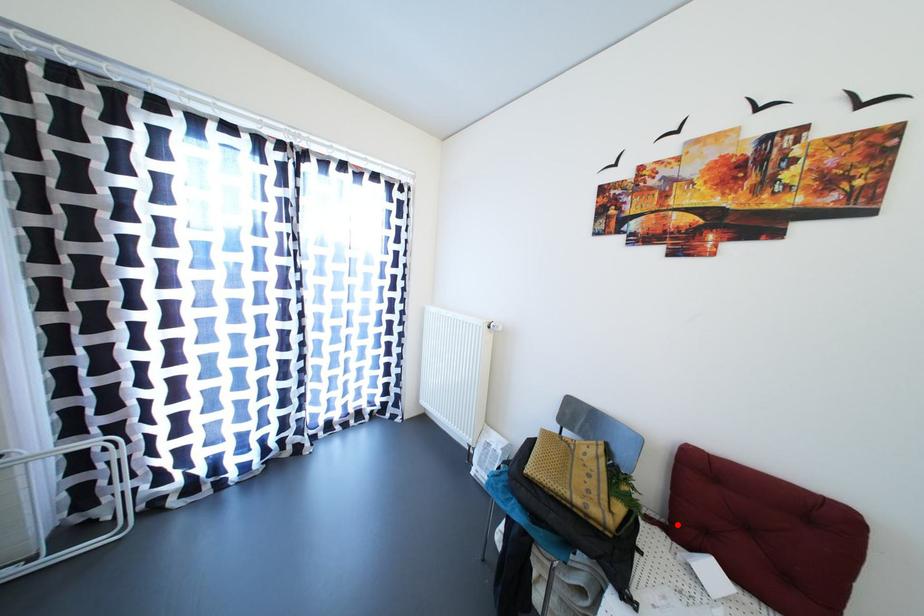
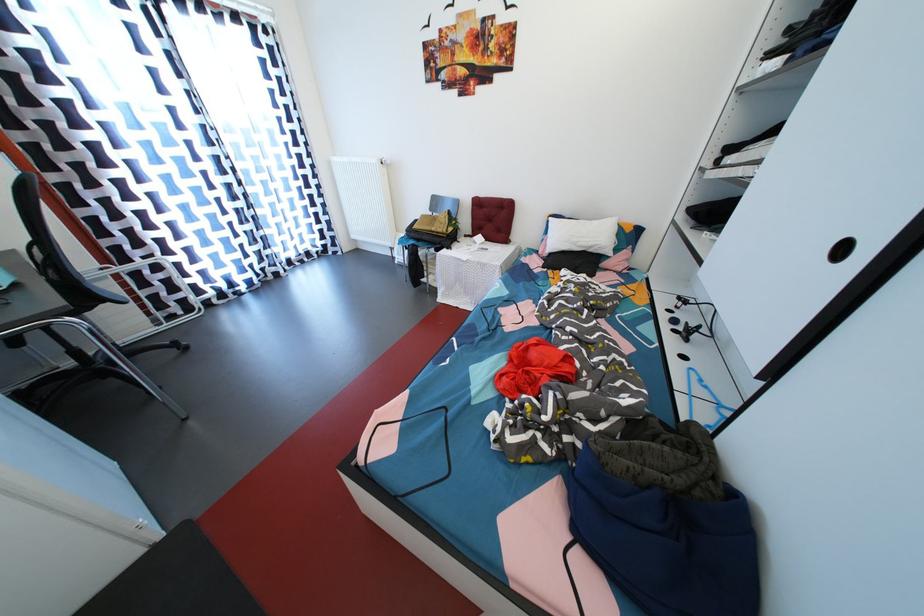
Locate, in the second image, the point that corresponds to the highlighted location in the first image.

(479, 237)